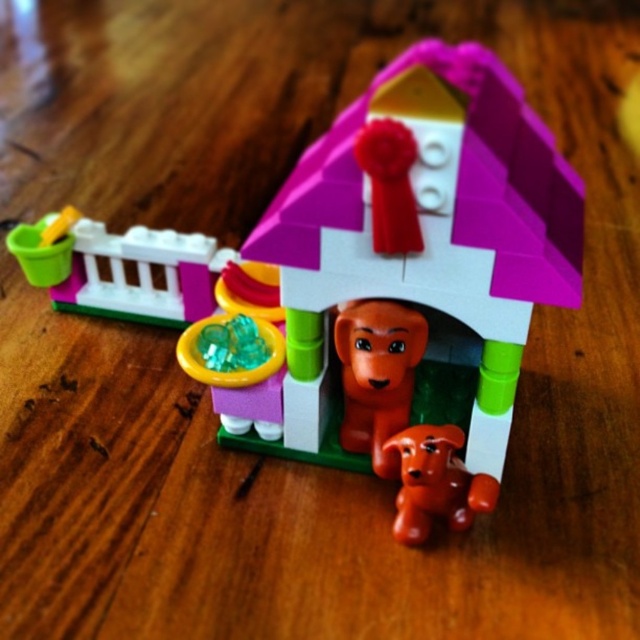
Between matte orange doll at center and matte plastic dog at lower center, which one appears on the left side from the viewer's perspective?

matte orange doll at center

Is point (416, 328) farther from camera compared to point (481, 481)?

No, (416, 328) is closer to viewer.

Between point (368, 448) and point (438, 477), which one is positioned in front?

Point (438, 477) is more forward.

Locate an element on the screen. The height and width of the screenshot is (640, 640). matte orange doll at center is located at coordinates (378, 376).

Can you confirm if smooth plastic bucket at left is positioned to the left of translucent green plastic bowl at center?

Correct, you'll find smooth plastic bucket at left to the left of translucent green plastic bowl at center.

Between point (80, 269) and point (232, 348), which one is positioned behind?

Point (80, 269)

This screenshot has height=640, width=640. Find the location of `smooth plastic bucket at left`. smooth plastic bucket at left is located at coordinates (122, 269).

Does matte plastic dog at lower center have a lesser height compared to translucent green plastic bowl at center?

Indeed, matte plastic dog at lower center has a lesser height compared to translucent green plastic bowl at center.

Is matte plastic dog at lower center bigger than translucent green plastic bowl at center?

Incorrect, matte plastic dog at lower center is not larger than translucent green plastic bowl at center.

The image size is (640, 640). Describe the element at coordinates (435, 481) in the screenshot. I see `matte plastic dog at lower center` at that location.

Locate an element on the screen. matte plastic dog at lower center is located at coordinates (435, 481).